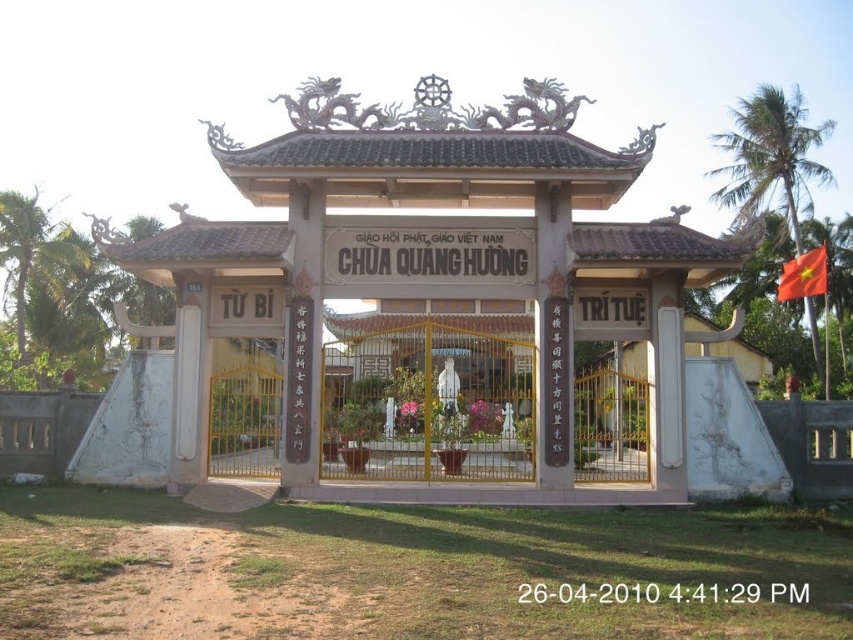
Which is more to the left, white stone gazebo at center or metallic gate at center?

Positioned to the left is metallic gate at center.

Does white stone gazebo at center have a lesser width compared to metallic gate at center?

Incorrect, white stone gazebo at center's width is not less than metallic gate at center's.

Does point (279, 236) come behind point (418, 417)?

No.

Locate an element on the screen. The image size is (853, 640). white stone gazebo at center is located at coordinates (431, 259).

Can you confirm if metallic gate at center is positioned below red fabric flag at upper right?

Correct, metallic gate at center is located below red fabric flag at upper right.

Between point (531, 419) and point (811, 264), which one is positioned in front?

Point (531, 419)

Where is `metallic gate at center`? metallic gate at center is located at coordinates (427, 397).

Does white stone gazebo at center have a lesser height compared to red fabric flag at upper right?

Incorrect, white stone gazebo at center's height does not fall short of red fabric flag at upper right's.

Which of these two, white stone gazebo at center or red fabric flag at upper right, stands taller?

white stone gazebo at center

Who is more forward, (227, 259) or (798, 257)?

Point (227, 259) is more forward.

You are a GUI agent. You are given a task and a screenshot of the screen. Output one action in this format:
    pyautogui.click(x=<x>, y=<y>)
    Task: Click on the white stone gazebo at center
    
    Given the screenshot: What is the action you would take?
    pyautogui.click(x=431, y=259)